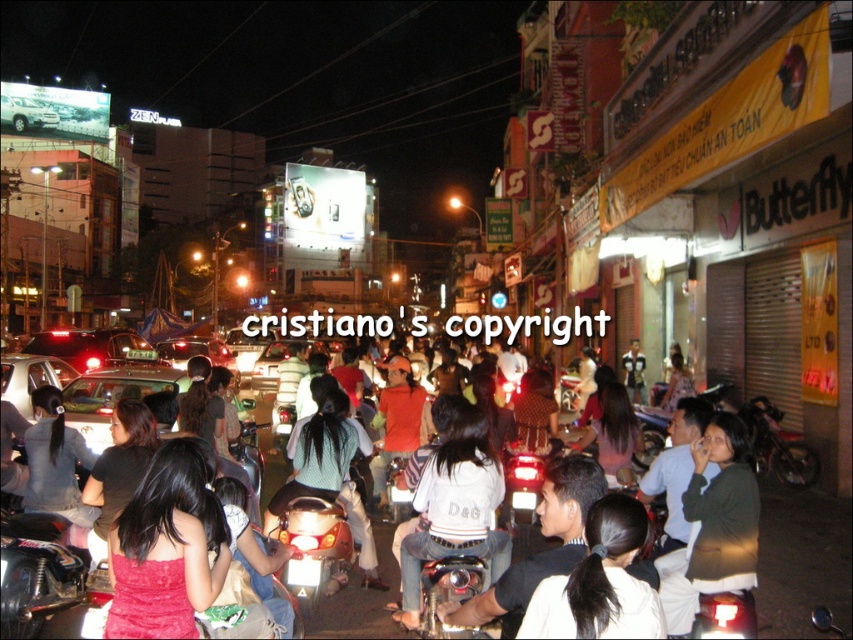
Can you confirm if dark brown leather jacket at center is positioned to the right of silver metallic suv at upper left?

Correct, you'll find dark brown leather jacket at center to the right of silver metallic suv at upper left.

Between dark brown leather jacket at center and silver metallic suv at upper left, which one is positioned lower?

dark brown leather jacket at center is below.

What do you see at coordinates (537, 481) in the screenshot? The width and height of the screenshot is (853, 640). I see `dark brown leather jacket at center` at bounding box center [537, 481].

What are the coordinates of `dark brown leather jacket at center` in the screenshot? It's located at (x=537, y=481).

Is denim jacket at center positioned behind matte black car at center?

No, it is not.

Is point (428, 486) more distant than point (102, 429)?

That is False.

Identify the location of denim jacket at center. The image size is (853, 640). (456, 508).

Based on the photo, who is positioned more to the left, matte red dress at center or denim jacket at lower left?

denim jacket at lower left is more to the left.

Is matte red dress at center below denim jacket at lower left?

No.

Between point (196, 580) and point (57, 499), which one is positioned behind?

Point (57, 499)

Where is `matte red dress at center`? The height and width of the screenshot is (640, 853). matte red dress at center is located at coordinates (165, 548).